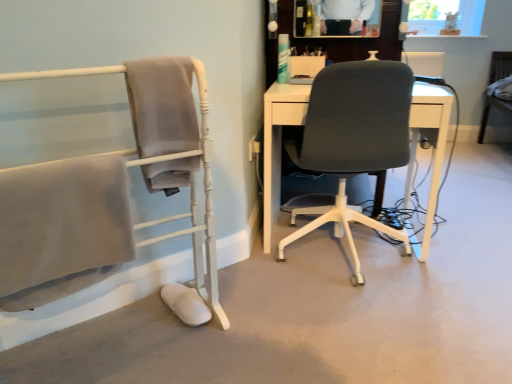
Identify the location of vacant location below matte gray chair at left, the first chair viewed from the front (from a real-world perspective). The image size is (512, 384). (119, 344).